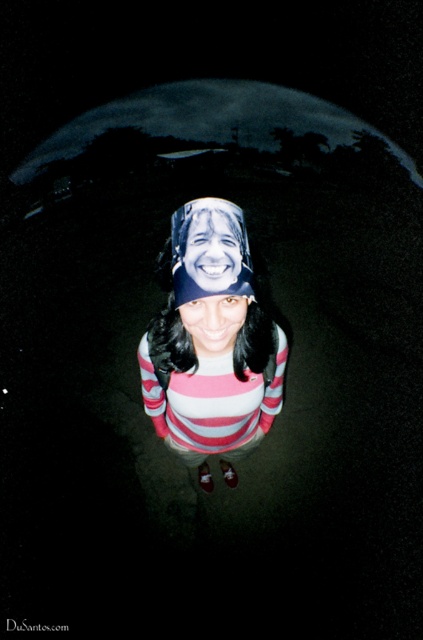
You are a photographer reviewing a portrait taken at night. The subject has a smooth plastic face at center and a matte striped shirt at center. Which object is closer to the camera?

The smooth plastic face at center is closer to the camera than the matte striped shirt at center because it is positioned in front of it.

You are a photographer adjusting your camera settings to focus on the striped cotton shirt at center and the smooth plastic face at center in the image. Which object should you focus on first to ensure proper depth of field?

You should focus on the striped cotton shirt at center first because it is closer to the viewer than the smooth plastic face at center, allowing for better depth of field adjustment.

You are a fashion designer observing the image. You need to determine which shirt is visible first when looking at the striped cotton shirt at center and the matte striped shirt at center. Which one is on top?

The striped cotton shirt at center is in front of the matte striped shirt at center, so it is the one visible on top.